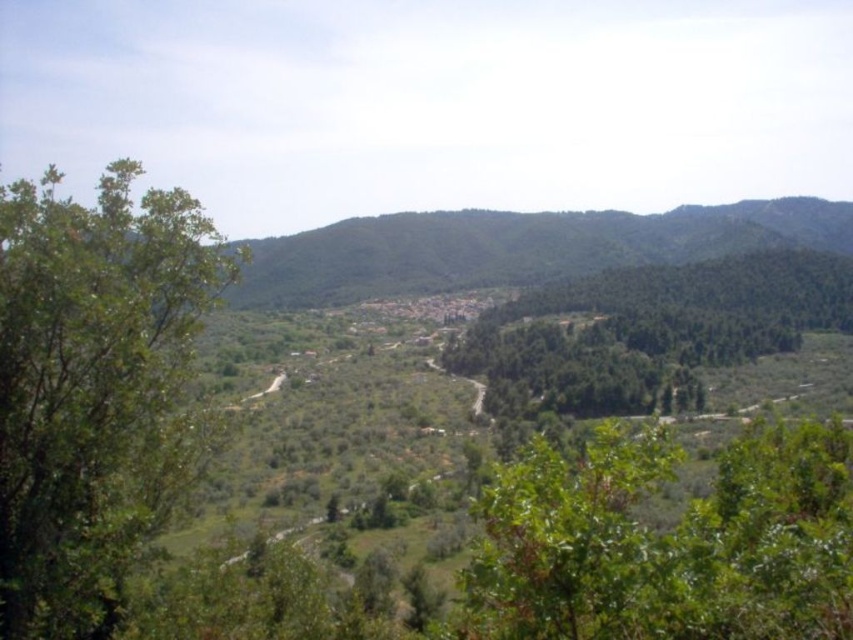
Question: Which object appears closest to the camera in this image?

Choices:
 (A) green leafy tree at left
 (B) green leafy tree at center

Answer: (B)

Question: Does green leafy tree at left have a greater width compared to green leafy tree at center?

Choices:
 (A) yes
 (B) no

Answer: (B)

Question: Does green leafy tree at center appear on the left side of green leafy trees at center?

Choices:
 (A) no
 (B) yes

Answer: (B)

Question: Which point is farther from the camera taking this photo?

Choices:
 (A) (103, 582)
 (B) (816, 449)

Answer: (B)

Question: Among these objects, which one is farthest from the camera?

Choices:
 (A) green leafy tree at left
 (B) green leafy trees at center
 (C) green leafy tree at center

Answer: (B)

Question: Is green leafy tree at center below green leafy trees at center?

Choices:
 (A) no
 (B) yes

Answer: (B)